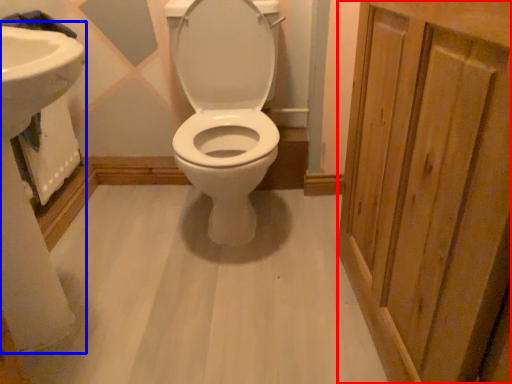
Question: Which object appears closest to the camera in this image, screen door (highlighted by a red box) or sink (highlighted by a blue box)?

Choices:
 (A) screen door
 (B) sink

Answer: (A)